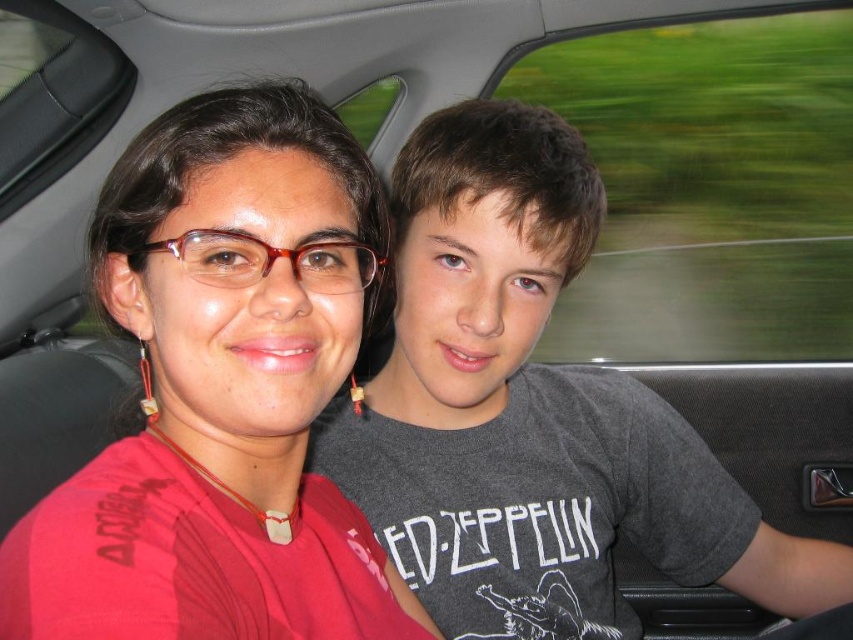
You are a passenger in the car and want to look outside through the transparent glass window at upper right and the transparent glass car window at upper left. Which window is closer to you?

The transparent glass window at upper right is closer to you than the transparent glass car window at upper left.

You are a passenger in the car and want to look outside through the transparent glass window at upper right and the transparent glass car window at upper left. Which window allows you to see more of the scenery above you?

The transparent glass window at upper right allows you to see more of the scenery above you because it is taller than the transparent glass car window at upper left.

You are a passenger in the car and want to check if your matte red glasses at center can fit inside the transparent glass car window at upper left without folding them. Can they fit based on their sizes?

The matte red glasses at center is smaller than the transparent glass car window at upper left, so they can fit inside without folding.